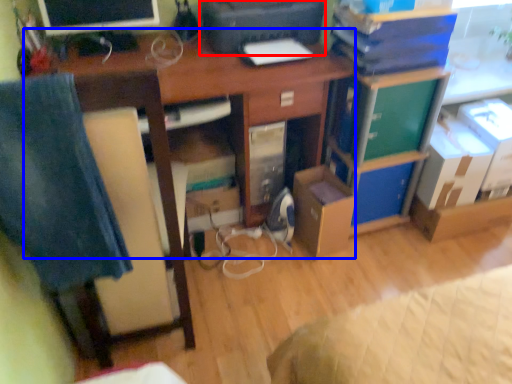
Question: Which object is further to the camera taking this photo, printer (highlighted by a red box) or desk (highlighted by a blue box)?

Choices:
 (A) printer
 (B) desk

Answer: (A)